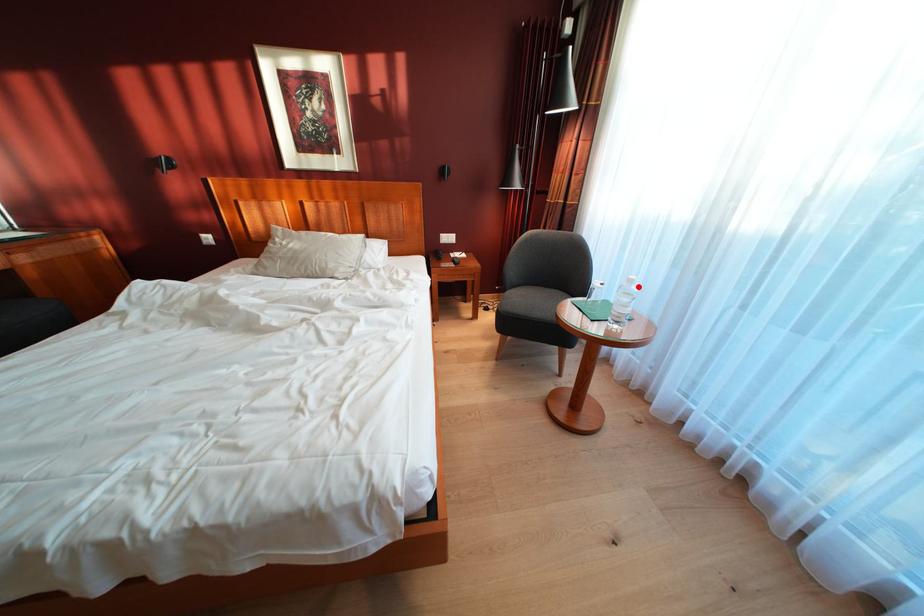
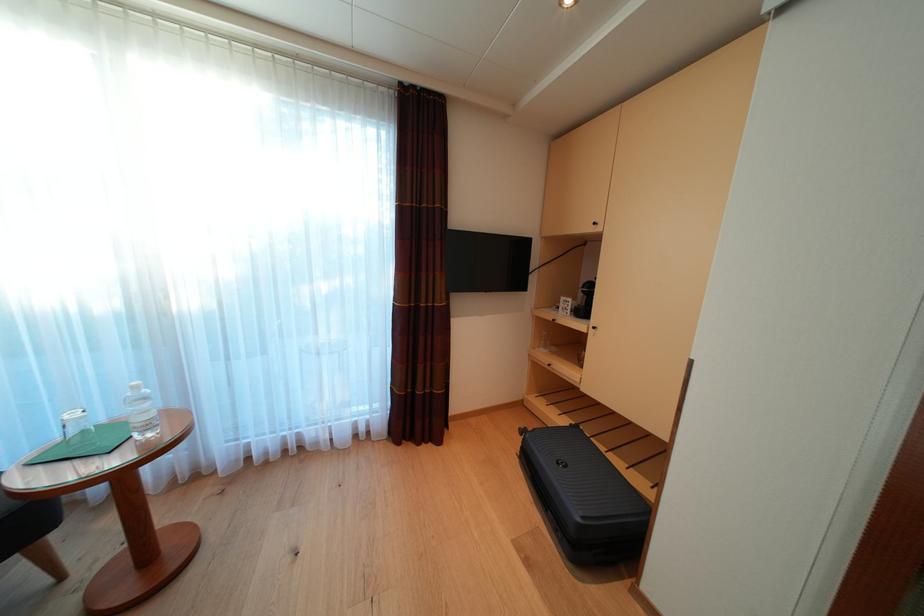
The point at the highlighted location is marked in the first image. Where is the corresponding point in the second image?

(144, 392)